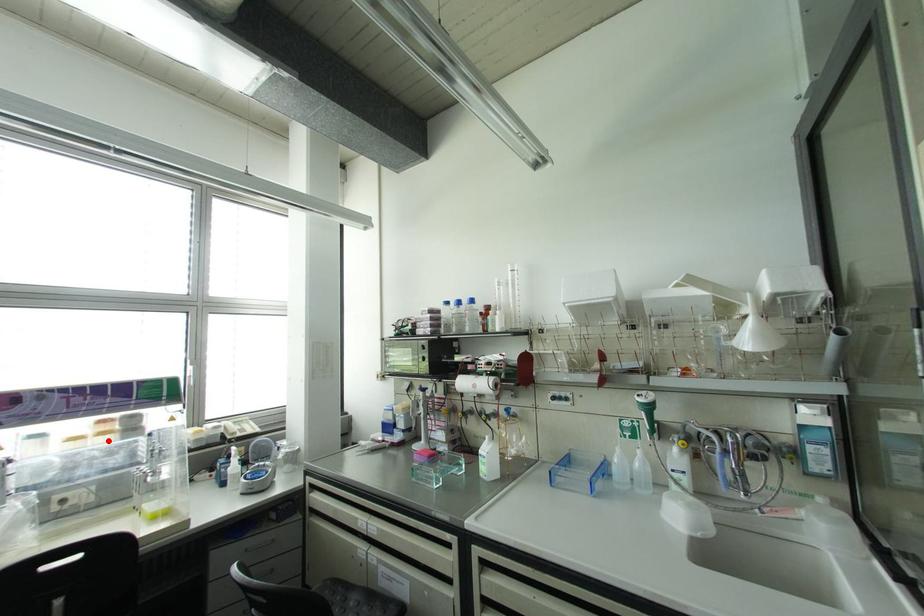
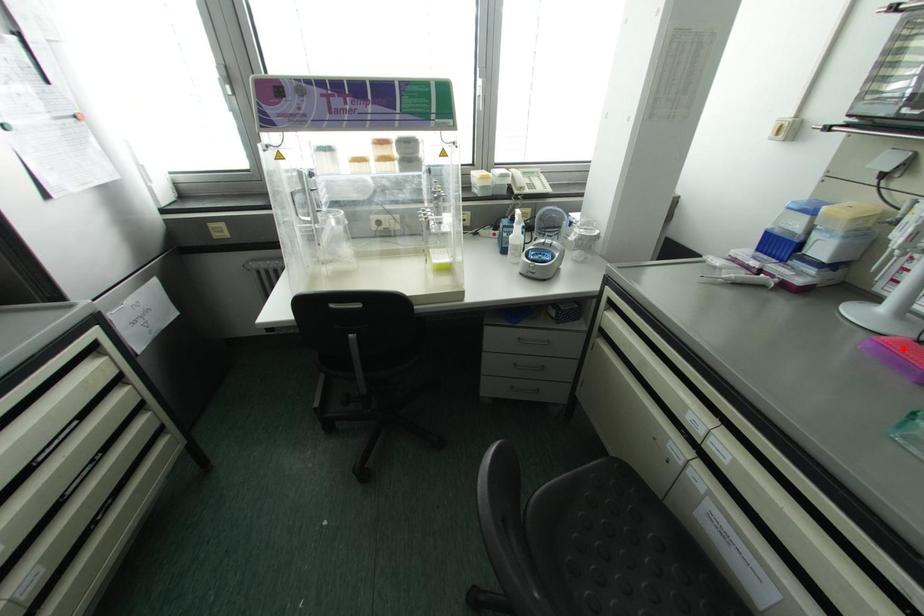
I am providing you with two images of the same scene from different viewpoints. A red point is marked on the first image and another point is marked on the second image. Is the marked point in image1 the same physical position as the marked point in image2?

No